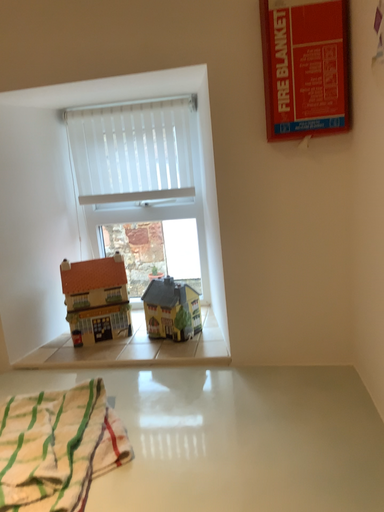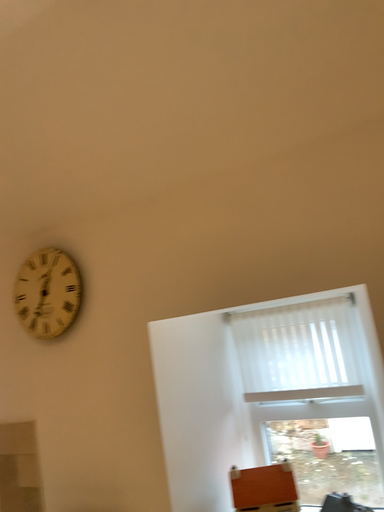
Question: Which way did the camera rotate in the video?

Choices:
 (A) rotated left
 (B) rotated right

Answer: (A)